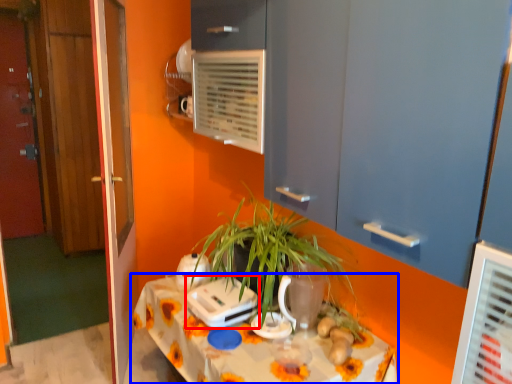
Question: Which object is further to the camera taking this photo, appliance (highlighted by a red box) or table (highlighted by a blue box)?

Choices:
 (A) appliance
 (B) table

Answer: (A)